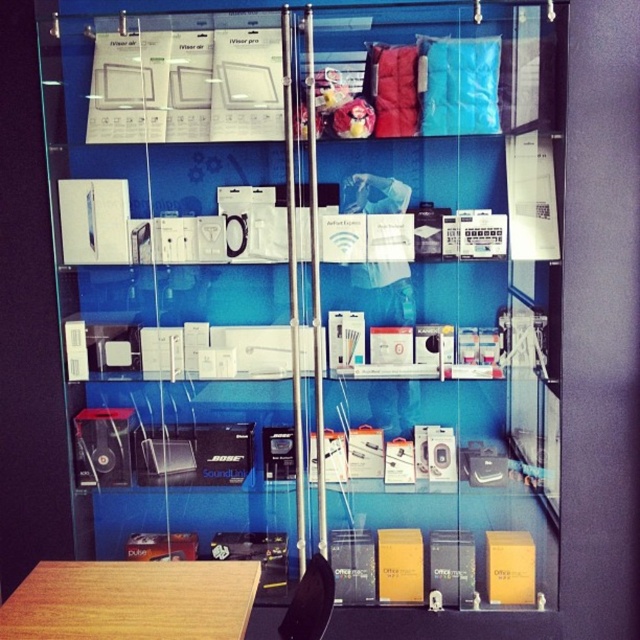
You are a customer standing in front of the glass display case. You want to see the items on the top shelf clearly. Which object, the transparent plastic glass door at upper center or the wooden table at lower left, would allow you to have a better view of the items on the top shelf?

The transparent plastic glass door at upper center has a greater height compared to the wooden table at lower left, so it would provide a better view of the items on the top shelf since it is taller and closer to the shelf level.

You are a delivery person who needs to place a large box that is 90 centimeters wide between the transparent plastic glass door at upper center and the wooden table at lower left. Based on the scene described, will the box fit between them?

The transparent plastic glass door at upper center and wooden table at lower left are 89.08 centimeters apart from each other. Since the box is 90 centimeters wide, it will not fit between them as the distance is slightly less than the box width.